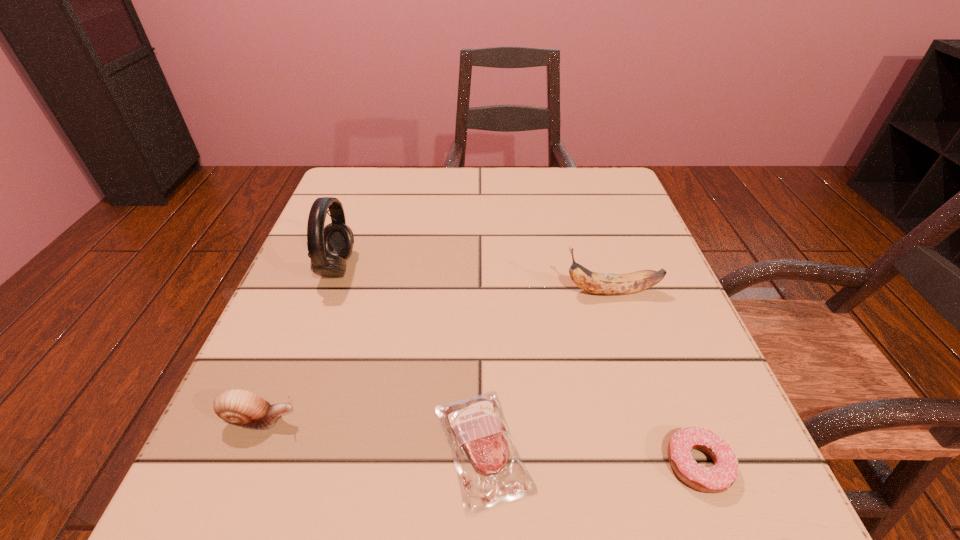
Identify the location of the tallest object. The image size is (960, 540). (328, 247).

This screenshot has height=540, width=960. Identify the location of the fourth shortest object. (599, 283).

Find the location of a particular element. escargot is located at coordinates (239, 407).

At what (x,y) coordinates should I click in order to perform the action: click on the fourth tallest object. Please return your answer as a coordinate pair (x, y). Image resolution: width=960 pixels, height=540 pixels. Looking at the image, I should click on (719, 478).

Identify the location of the shortest object. This screenshot has width=960, height=540. tap(486, 458).

Locate an element on the screen. This screenshot has width=960, height=540. the third object from left to right is located at coordinates (486, 458).

Locate an element on the screen. The image size is (960, 540). vacant space located on the earcups of the tallest object is located at coordinates (480, 267).

Where is `blank space located on the peel of the banana`? blank space located on the peel of the banana is located at coordinates (368, 292).

Locate an element on the screen. vacant space situated 0.400m on the peel of the banana is located at coordinates (346, 292).

Find the location of a particular element. The width and height of the screenshot is (960, 540). blank area located 0.300m on the peel of the banana is located at coordinates (399, 292).